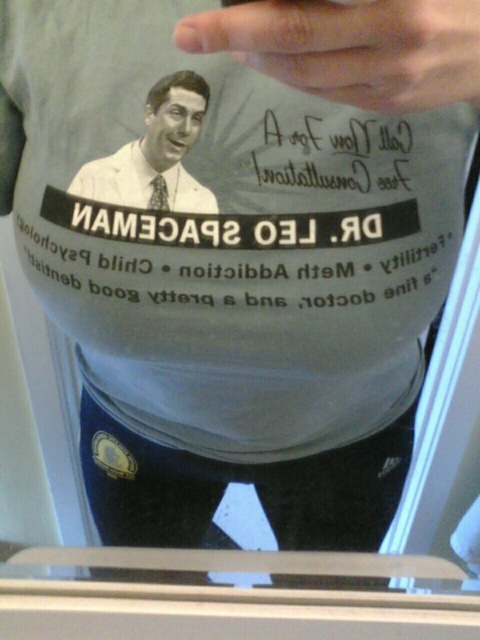
Can you confirm if white matte t-shirt at center is positioned below matte white tie at upper left?

Correct, white matte t-shirt at center is located below matte white tie at upper left.

Which is more to the right, white matte t-shirt at center or matte white tie at upper left?

white matte t-shirt at center

Between point (364, 368) and point (193, 93), which one is positioned in front?

Point (193, 93) is more forward.

The height and width of the screenshot is (640, 480). I want to click on white matte t-shirt at center, so click(x=228, y=218).